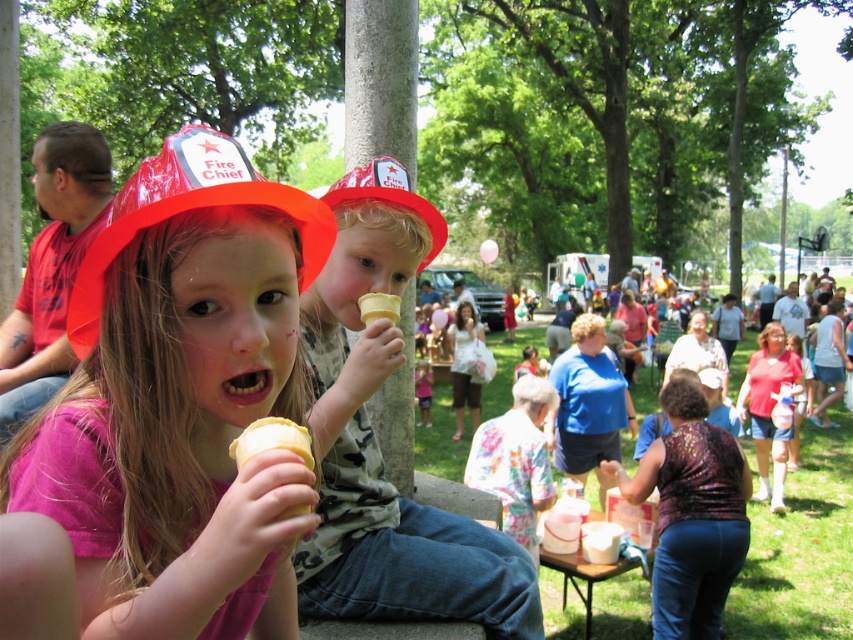
Does point (142, 184) come farther from viewer compared to point (374, 198)?

That is False.

Does matte plastic fire chief hat at left come in front of matte plastic fire chief hat at upper center?

Yes, matte plastic fire chief hat at left is closer to the viewer.

Is point (257, 308) closer to camera compared to point (428, 252)?

Yes, point (257, 308) is closer to viewer.

Where is `matte plastic fire chief hat at left`? The image size is (853, 640). matte plastic fire chief hat at left is located at coordinates (181, 401).

Measure the distance between matte plastic ice cream cone at center and matte plastic fire chief hat at upper center.

18.63 inches

Measure the distance between matte plastic ice cream cone at center and camera.

matte plastic ice cream cone at center is 4.94 feet away from camera.

Who is more forward, [496,568] or [323,202]?

Point [323,202] is more forward.

At what (x,y) coordinates should I click in order to perform the action: click on matte plastic ice cream cone at center. Please return your answer as a coordinate pair (x, y). Looking at the image, I should click on (376, 444).

Can you confirm if matte plastic fire chief hat at upper center is shorter than yellow waffle cone ice cream at center?

No, matte plastic fire chief hat at upper center is not shorter than yellow waffle cone ice cream at center.

Between matte plastic fire chief hat at upper center and yellow waffle cone ice cream at center, which one appears on the right side from the viewer's perspective?

Positioned to the right is matte plastic fire chief hat at upper center.

This screenshot has height=640, width=853. I want to click on matte plastic fire chief hat at upper center, so click(x=389, y=196).

This screenshot has width=853, height=640. What are the coordinates of `matte plastic fire chief hat at upper center` in the screenshot? It's located at (389, 196).